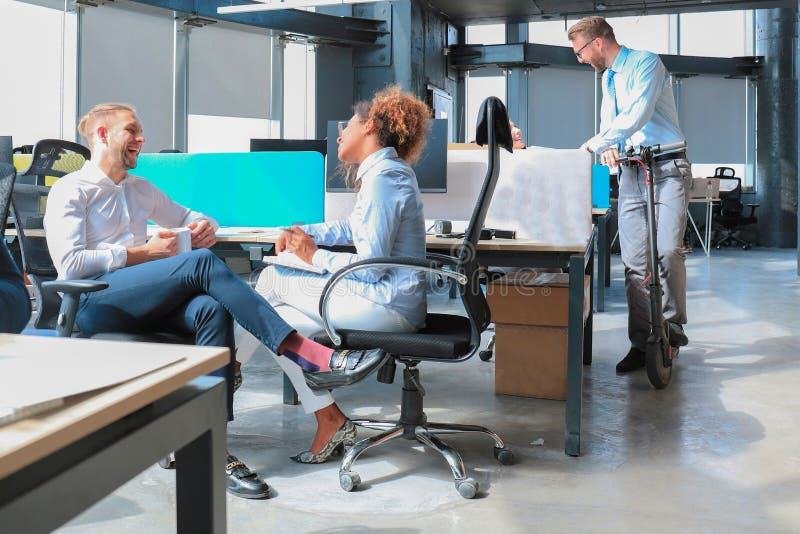
Locate an element on the screen. This screenshot has height=534, width=800. wooden boxes beneath desk is located at coordinates (548, 307), (530, 361), (494, 392), (489, 277), (557, 388).